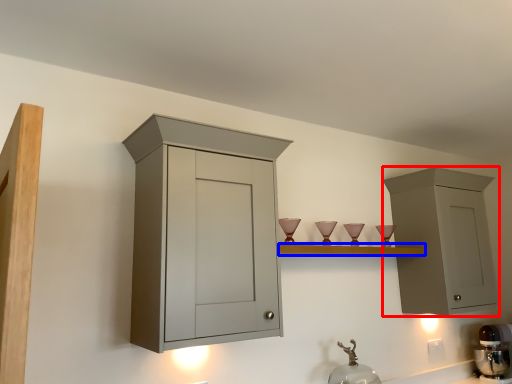
Question: Which point is closer to the camera, cabinetry (highlighted by a red box) or shelf (highlighted by a blue box)?

Choices:
 (A) cabinetry
 (B) shelf

Answer: (B)